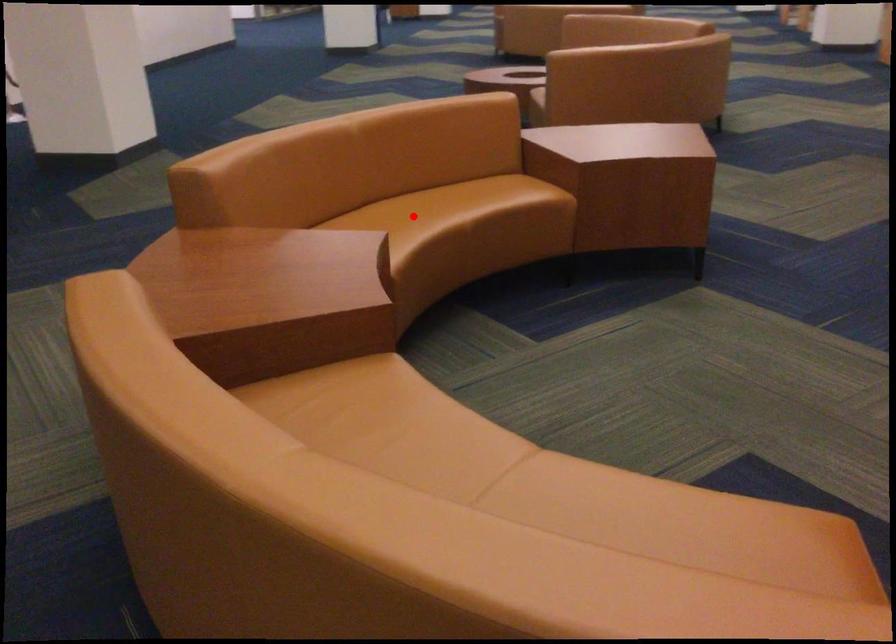
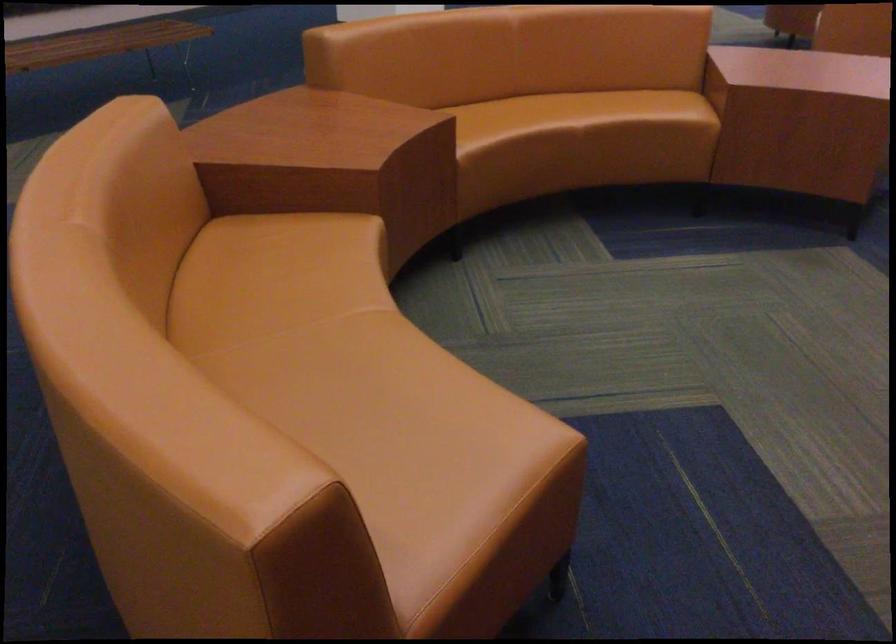
The point at the highlighted location is marked in the first image. Where is the corresponding point in the second image?

(538, 113)